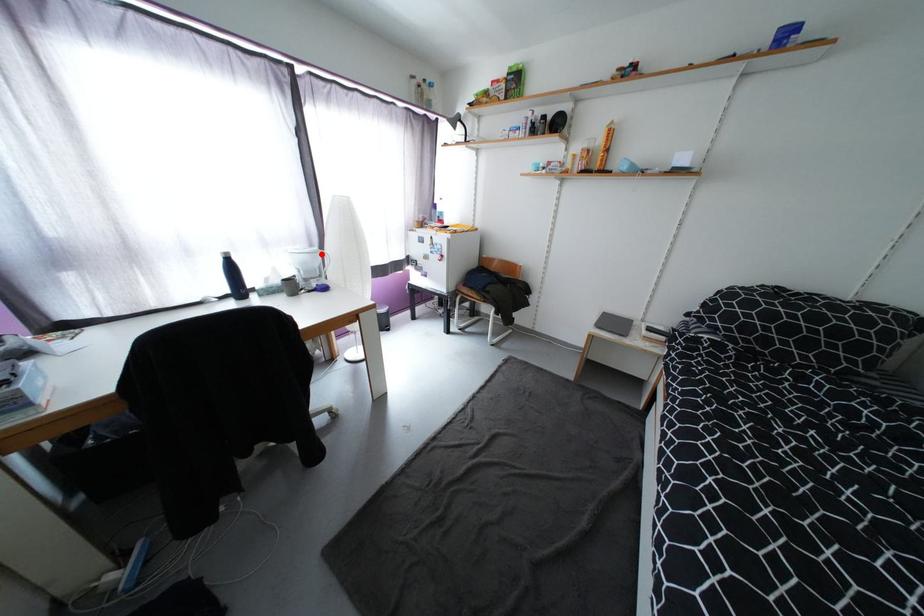
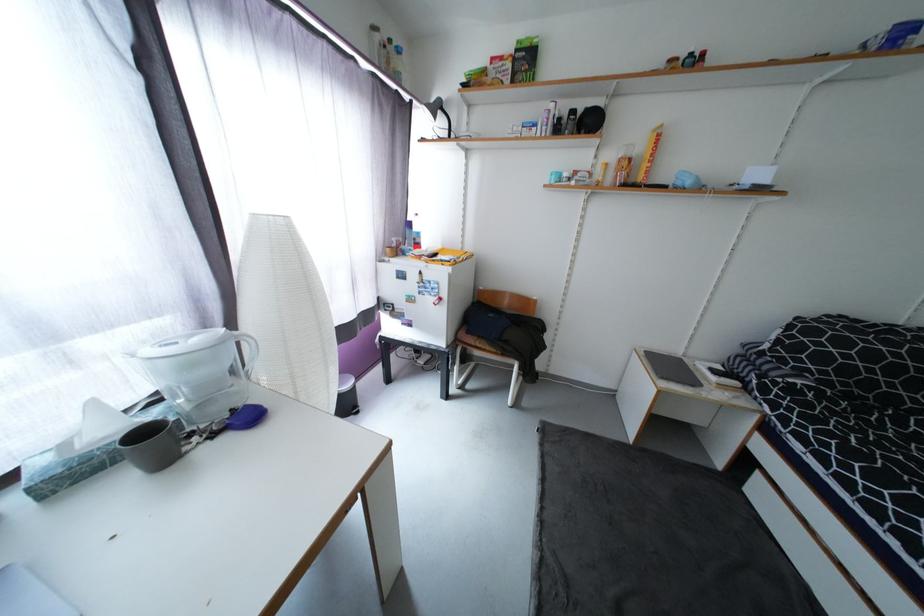
Where in the second image is the point corresponding to the highlighted location from the first image?

(226, 342)